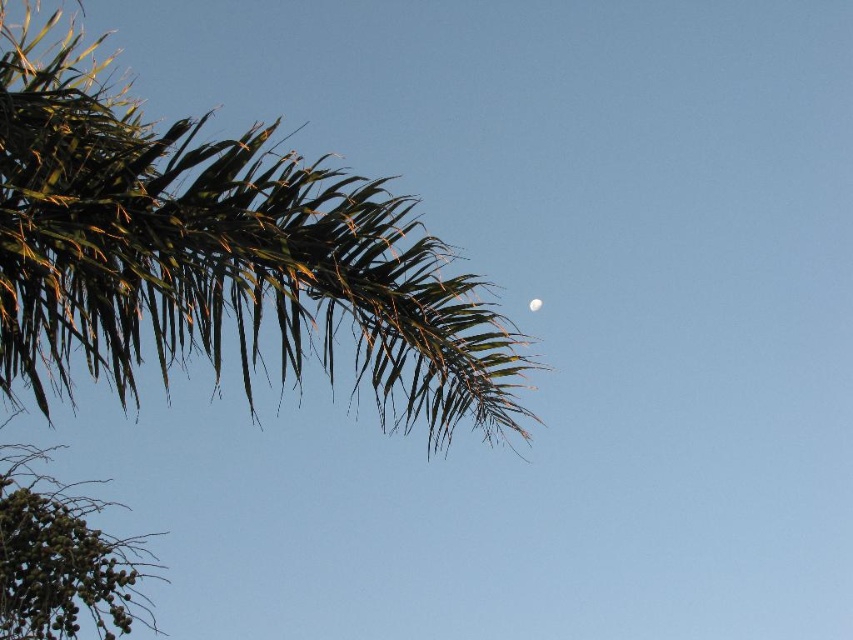
In the scene shown: Is green leafy palm at upper left positioned before white glossy moon at upper center?

Yes, green leafy palm at upper left is in front of white glossy moon at upper center.

Can you confirm if green leafy palm at upper left is taller than white glossy moon at upper center?

Yes.

Does point (189, 154) come farther from viewer compared to point (534, 305)?

That is False.

I want to click on green leafy palm at upper left, so click(218, 256).